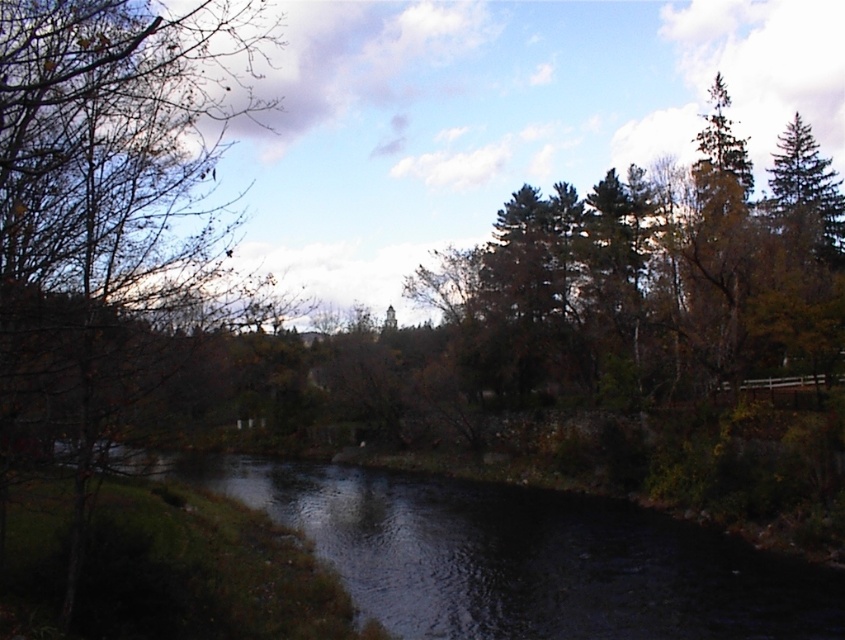
Who is positioned more to the left, brown leafy tree at left or dark reflective water at center?

brown leafy tree at left

Describe the element at coordinates (112, 212) in the screenshot. The image size is (845, 640). I see `brown leafy tree at left` at that location.

You are a GUI agent. You are given a task and a screenshot of the screen. Output one action in this format:
    pyautogui.click(x=<x>, y=<y>)
    Task: Click on the brown leafy tree at left
    The image size is (845, 640).
    Given the screenshot: What is the action you would take?
    pyautogui.click(x=112, y=212)